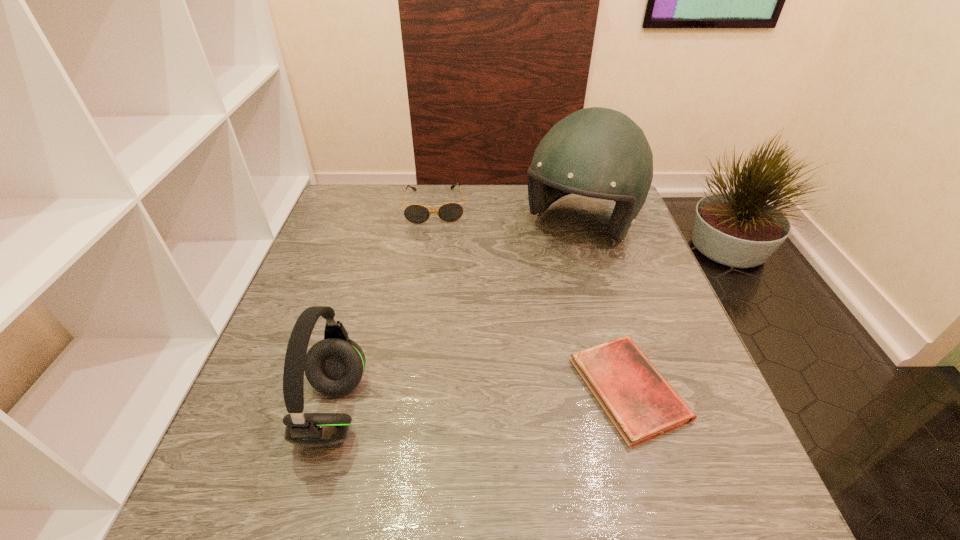
Where is `the third shortest object`? the third shortest object is located at coordinates (334, 366).

This screenshot has width=960, height=540. What are the coordinates of `the shortest object` in the screenshot? It's located at (641, 404).

The image size is (960, 540). Find the location of `sunglasses`. sunglasses is located at coordinates (449, 212).

Where is `football helmet`? This screenshot has height=540, width=960. football helmet is located at coordinates (596, 152).

This screenshot has width=960, height=540. What are the coordinates of `vacant space located on the ear cups of the second tallest object` in the screenshot? It's located at (272, 410).

The width and height of the screenshot is (960, 540). Identify the location of blank area located on the left of the shortest object. (372, 389).

This screenshot has width=960, height=540. Find the location of `blank space located on the lenses of the third tallest object`. blank space located on the lenses of the third tallest object is located at coordinates (439, 302).

At what (x,y) coordinates should I click in order to perform the action: click on vacant space situated 0.400m on the lenses of the third tallest object. Please return your answer as a coordinate pair (x, y). Looking at the image, I should click on (440, 328).

At what (x,y) coordinates should I click in order to perform the action: click on vacant space located on the lenses of the third tallest object. Please return your answer as a coordinate pair (x, y). This screenshot has height=540, width=960. Looking at the image, I should click on (438, 262).

Identify the location of vacant space situated at the face opening of the tallest object. The width and height of the screenshot is (960, 540). (486, 355).